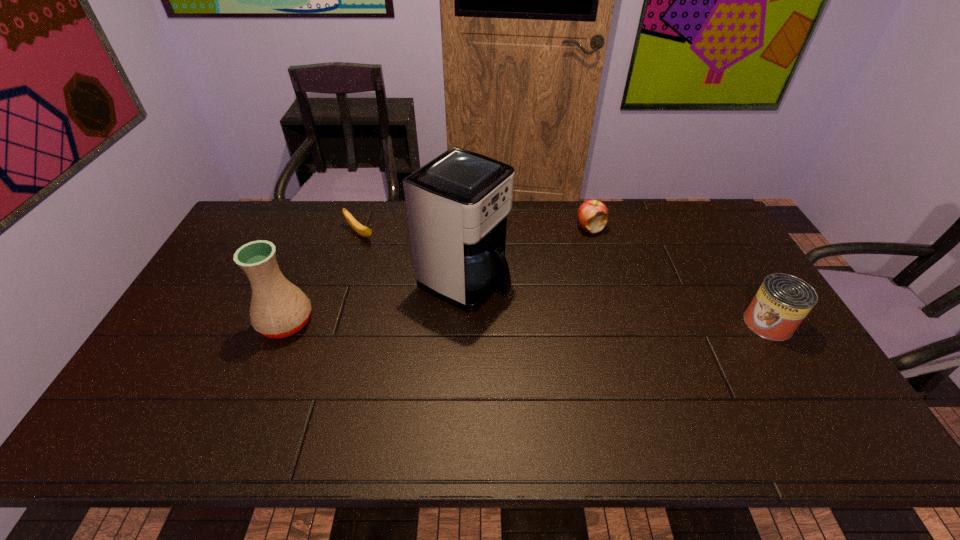
The width and height of the screenshot is (960, 540). Identify the location of free space on the desktop that is between the fourth shortest object and the third tallest object and is positioned on the bitten side of the fourth object from left to right. (546, 323).

Locate an element on the screen. free space on the desktop that is between the pottery and the third tallest object and is positioned at the stem of the banana is located at coordinates (482, 323).

Where is `vacant space on the desktop that is between the second tallest object and the third tallest object and is positioned on the front panel of the third object from right to left`? vacant space on the desktop that is between the second tallest object and the third tallest object and is positioned on the front panel of the third object from right to left is located at coordinates (554, 323).